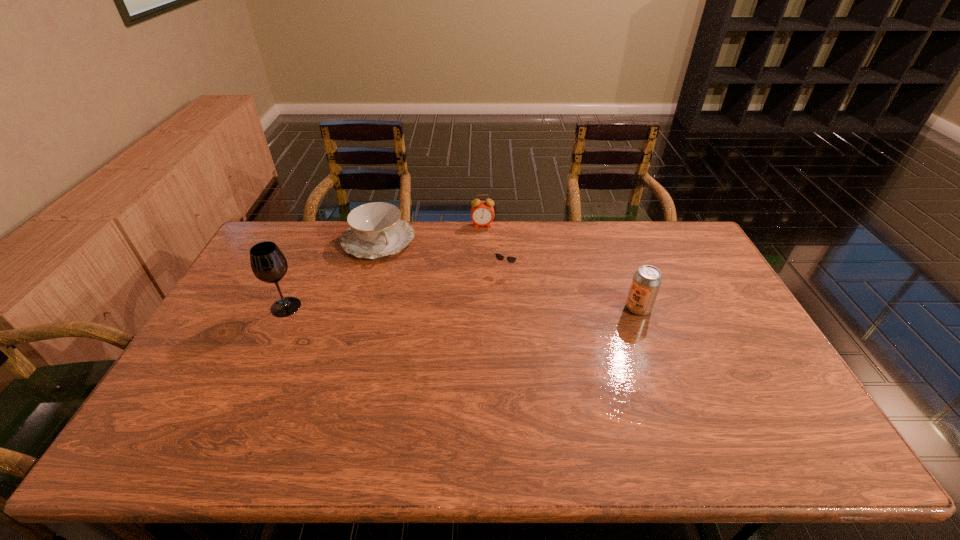
Image resolution: width=960 pixels, height=540 pixels. What are the coordinates of `vacant space on the desktop that is between the wineglass and the beer can and is positioned in front of the lenses of the sunglasses` in the screenshot? It's located at (485, 308).

Where is `free space on the desktop that is between the tallest object and the beer can and is positioned on the face of the alarm clock`? The height and width of the screenshot is (540, 960). free space on the desktop that is between the tallest object and the beer can and is positioned on the face of the alarm clock is located at coordinates [x=491, y=308].

The width and height of the screenshot is (960, 540). In order to click on free spot on the desktop that is between the wineglass and the beer can and is positioned on the handle side of the fourth object from right to left in this screenshot , I will do `click(421, 307)`.